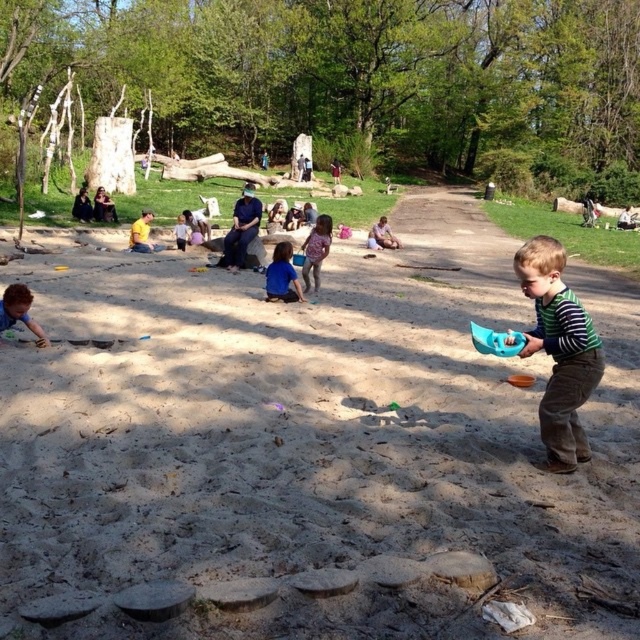
Question: Is the position of brown sandy dirt at center less distant than that of yellow fabric shirt at center?

Choices:
 (A) yes
 (B) no

Answer: (A)

Question: Which point is farther to the camera?

Choices:
 (A) green striped shirt at right
 (B) blue matte shirt at center
 (C) brown plastic bucket at lower right
 (D) blue striped shirt at center

Answer: (D)

Question: Can you confirm if green striped shirt at right is thinner than blue rubber boat at right?

Choices:
 (A) yes
 (B) no

Answer: (B)

Question: Which object is closer to the camera taking this photo?

Choices:
 (A) yellow fabric shirt at center
 (B) green striped shirt at right
 (C) smooth beige sand at center

Answer: (B)

Question: Is brown sandy dirt at center above green striped shirt at right?

Choices:
 (A) yes
 (B) no

Answer: (A)

Question: Which of the following is the closest to the observer?

Choices:
 (A) yellow fabric shirt at center
 (B) smooth beige sand at center

Answer: (A)